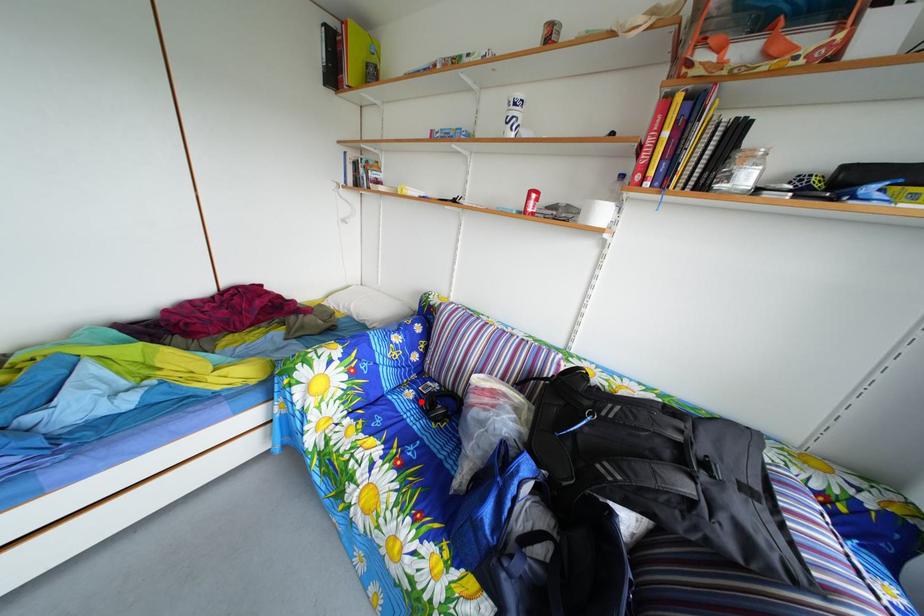
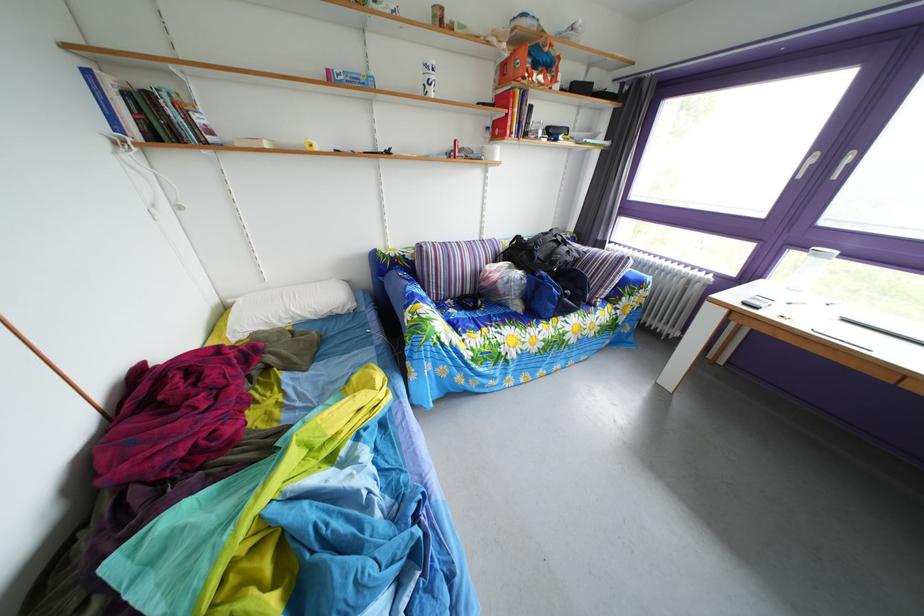
Where in the second image is the point corresponding to the highlighted location from the first image?

(463, 320)